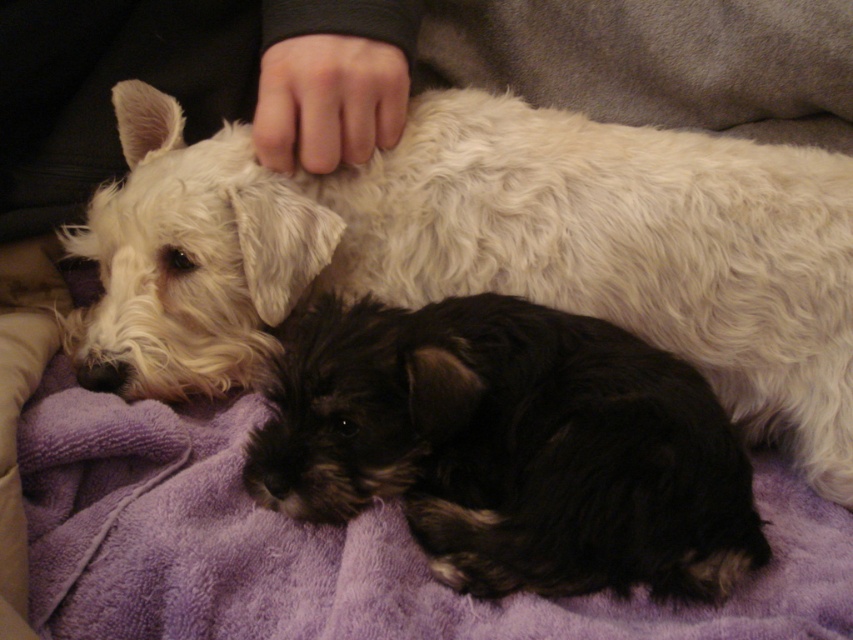
Question: Which object appears closest to the camera in this image?

Choices:
 (A) black shaggy dog at center
 (B) white fluffy dog at upper left

Answer: (A)

Question: Does white fluffy dog at upper left appear on the right side of black shaggy dog at center?

Choices:
 (A) no
 (B) yes

Answer: (A)

Question: Is the position of white fluffy dog at upper left more distant than that of black shaggy dog at center?

Choices:
 (A) no
 (B) yes

Answer: (B)

Question: Which point is closer to the camera?

Choices:
 (A) white fluffy dog at upper left
 (B) black shaggy dog at center

Answer: (B)

Question: Is white fluffy dog at upper left closer to the viewer compared to black shaggy dog at center?

Choices:
 (A) yes
 (B) no

Answer: (B)